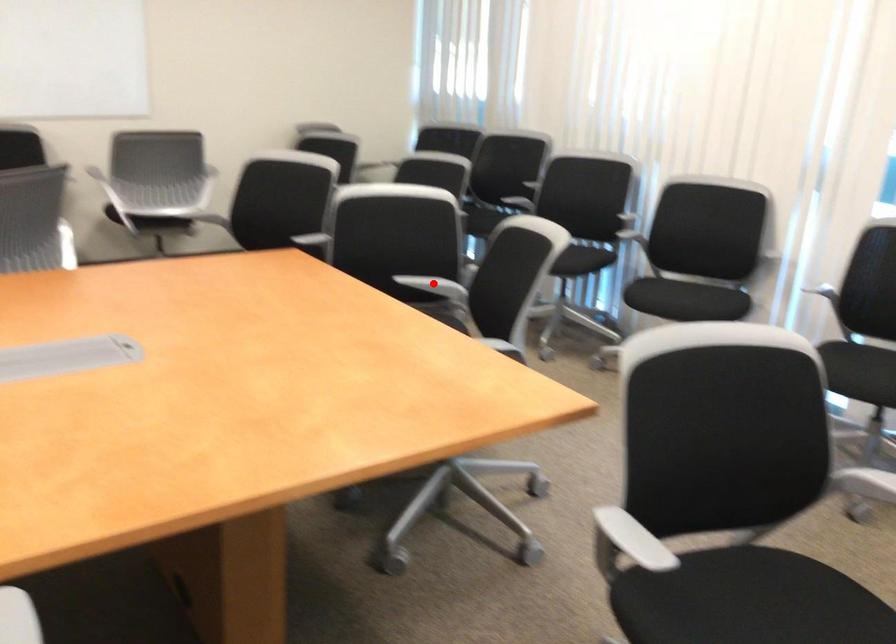
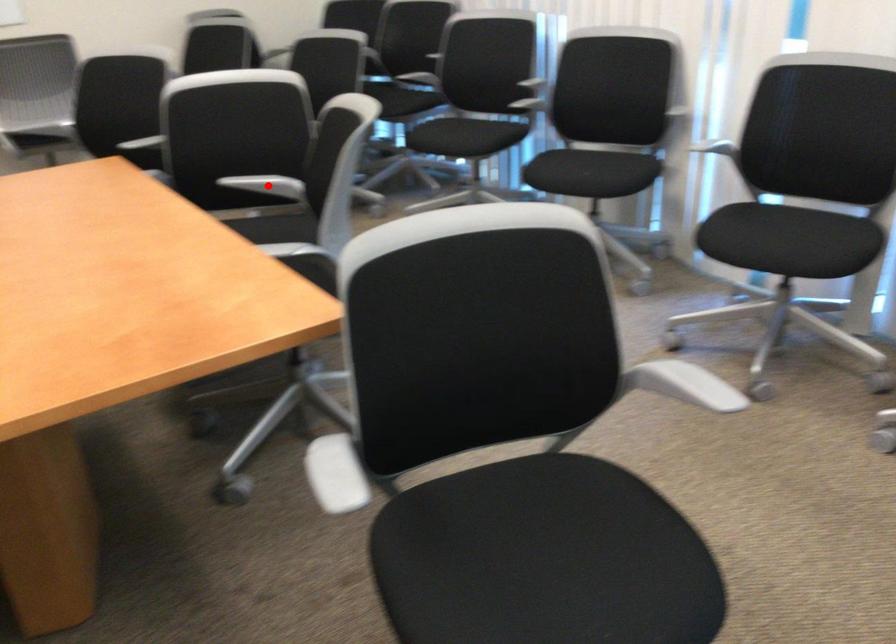
I am providing you with two images of the same scene from different viewpoints. A red point is marked on the first image and another point is marked on the second image. Is the red point in image1 aligned with the point shown in image2?

Yes